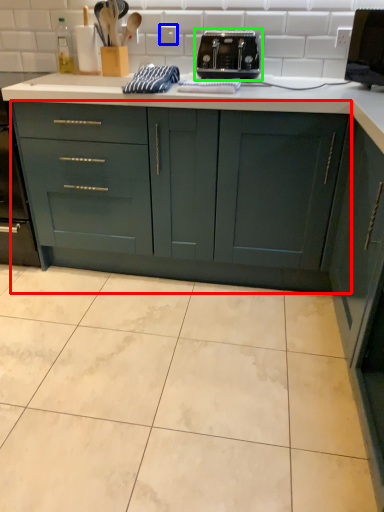
Question: Estimate the real-world distances between objects in this image. Which object is closer to cabinetry (highlighted by a red box), electric outlet (highlighted by a blue box) or toaster (highlighted by a green box)?

Choices:
 (A) electric outlet
 (B) toaster

Answer: (B)